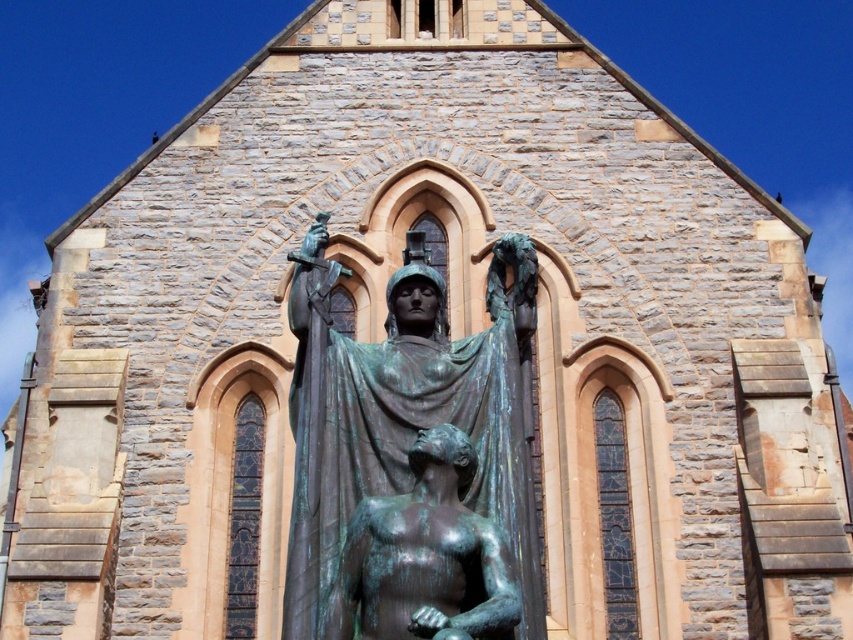
Is bronze statue at center thinner than green patina statue at center?

No, bronze statue at center is not thinner than green patina statue at center.

Can you confirm if bronze statue at center is taller than green patina statue at center?

Yes, bronze statue at center is taller than green patina statue at center.

You are a GUI agent. You are given a task and a screenshot of the screen. Output one action in this format:
    pyautogui.click(x=<x>, y=<y>)
    Task: Click on the bronze statue at center
    The image size is (853, 640).
    Given the screenshot: What is the action you would take?
    pyautogui.click(x=407, y=413)